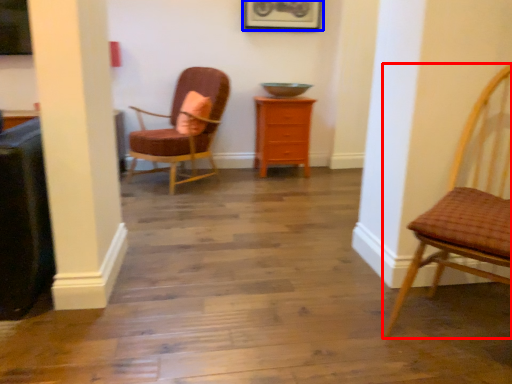
Question: Which of the following is the closest to the observer, chair (highlighted by a red box) or picture frame (highlighted by a blue box)?

Choices:
 (A) chair
 (B) picture frame

Answer: (A)